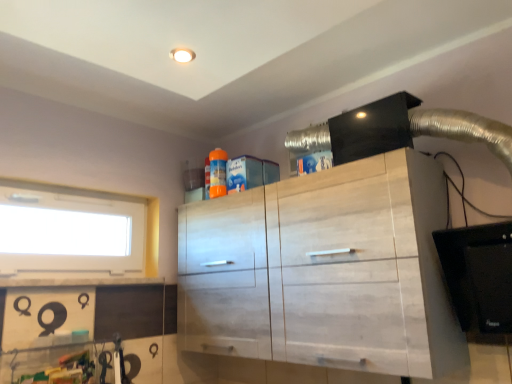
Identify the location of light wood cabinet at center. This screenshot has height=384, width=512. (328, 270).

Describe the element at coordinates (328, 270) in the screenshot. I see `light wood cabinet at center` at that location.

I want to click on light wood cabinet at center, so click(x=328, y=270).